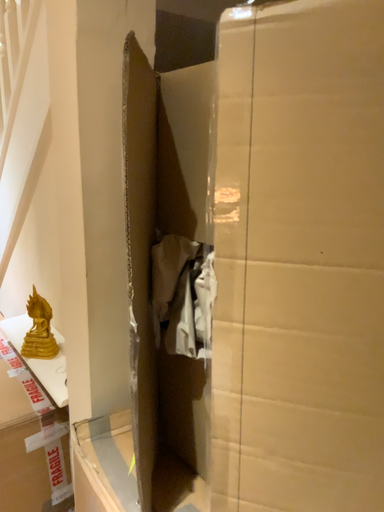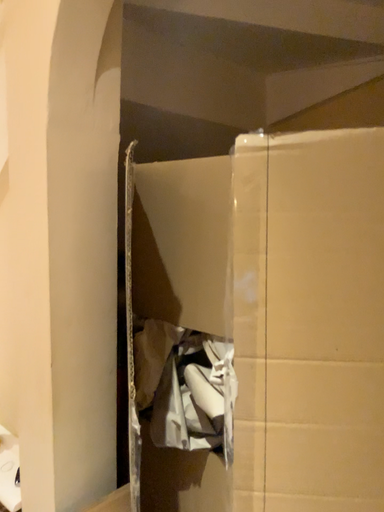
Question: How did the camera likely rotate when shooting the video?

Choices:
 (A) rotated downward
 (B) rotated upward

Answer: (B)